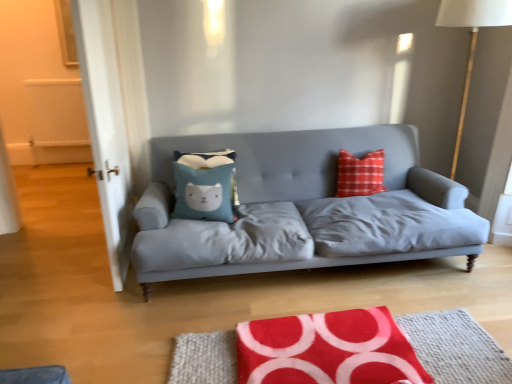
Question: Could you tell me if blue fabric pillow at center is turned towards transparent glass door at left?

Choices:
 (A) yes
 (B) no

Answer: (B)

Question: Is blue fabric pillow at center to the right of transparent glass door at left from the viewer's perspective?

Choices:
 (A) no
 (B) yes

Answer: (B)

Question: Is blue fabric pillow at center surrounding transparent glass door at left?

Choices:
 (A) no
 (B) yes

Answer: (A)

Question: Are blue fabric pillow at center and transparent glass door at left far apart?

Choices:
 (A) yes
 (B) no

Answer: (B)

Question: Can you confirm if blue fabric pillow at center is wider than transparent glass door at left?

Choices:
 (A) no
 (B) yes

Answer: (B)

Question: Can you confirm if blue fabric pillow at center is taller than transparent glass door at left?

Choices:
 (A) no
 (B) yes

Answer: (A)

Question: Is transparent glass door at left at the right side of white fabric lampshade at right?

Choices:
 (A) no
 (B) yes

Answer: (A)

Question: Is the position of transparent glass door at left more distant than that of white fabric lampshade at right?

Choices:
 (A) yes
 (B) no

Answer: (B)

Question: Is white fabric lampshade at right located within transparent glass door at left?

Choices:
 (A) no
 (B) yes

Answer: (A)

Question: Is transparent glass door at left thinner than white fabric lampshade at right?

Choices:
 (A) no
 (B) yes

Answer: (B)

Question: Is transparent glass door at left with white fabric lampshade at right?

Choices:
 (A) yes
 (B) no

Answer: (B)

Question: Considering the relative sizes of transparent glass door at left and white fabric lampshade at right in the image provided, is transparent glass door at left taller than white fabric lampshade at right?

Choices:
 (A) yes
 (B) no

Answer: (A)

Question: Is blue fabric pillow at center not inside red fabric rug at lower center?

Choices:
 (A) yes
 (B) no

Answer: (A)